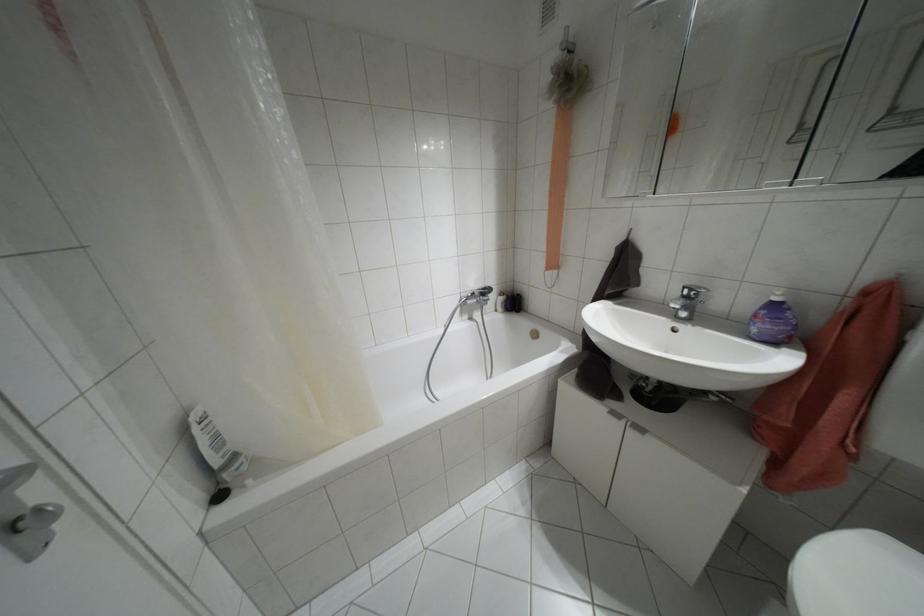
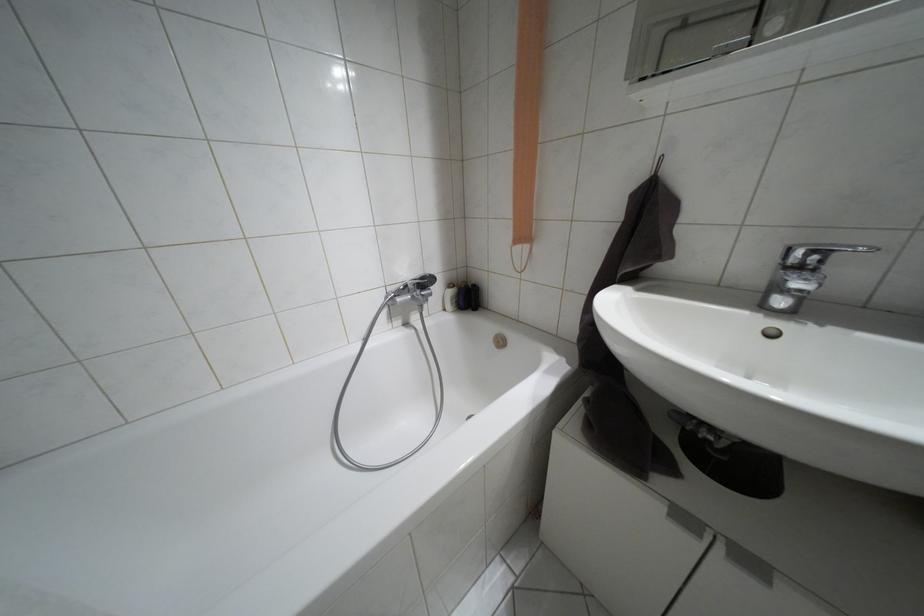
Question: The images are taken continuously from a first-person perspective. In which direction is your viewpoint rotating?

Choices:
 (A) Left
 (B) Right
 (C) Up
 (D) Down

Answer: (B)